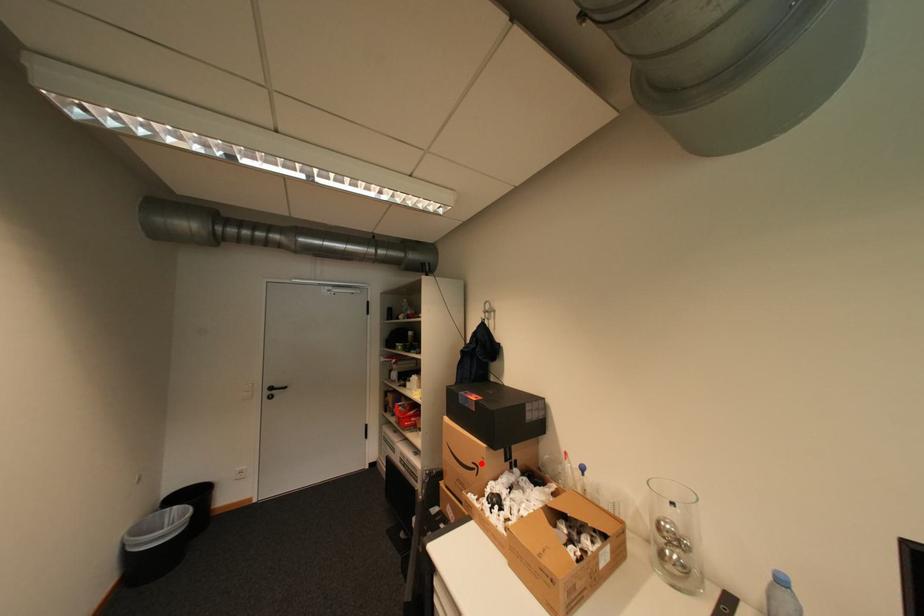
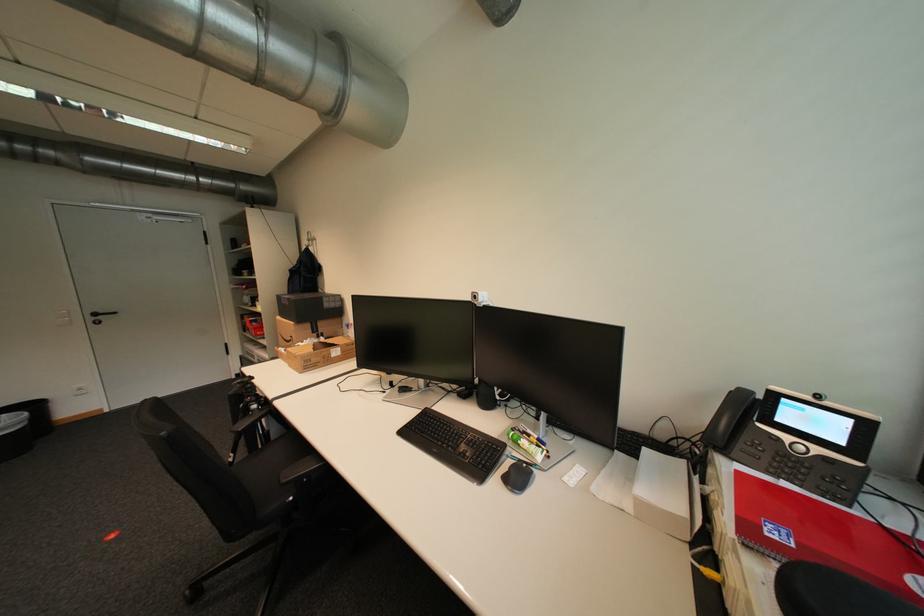
Question: A red point is marked in image1. In image2, is the corresponding 3D point closer to the camera or farther? Reply with the corresponding letter.

Choices:
 (A) The corresponding 3D point is closer.
 (B) The corresponding 3D point is farther.

Answer: (A)